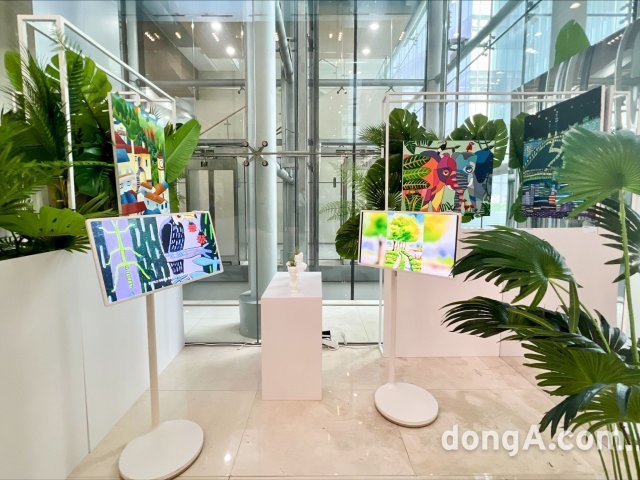
Where is `glass walls`? glass walls is located at coordinates point(337,125), point(221,109).